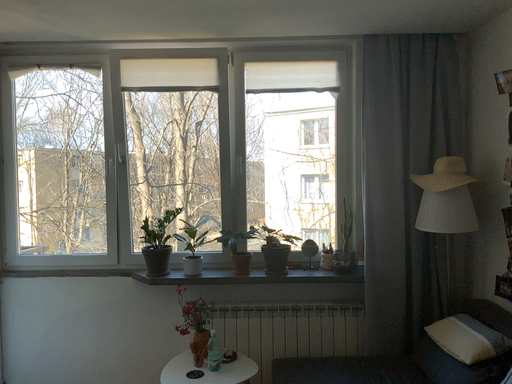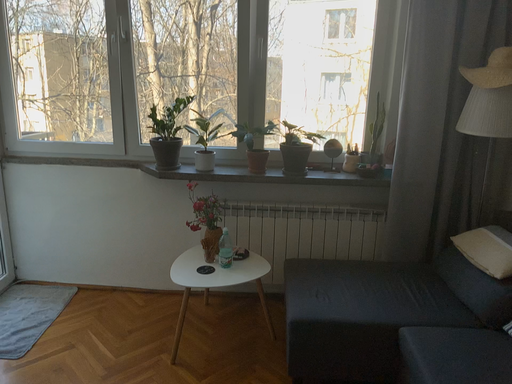
Question: How did the camera likely rotate when shooting the video?

Choices:
 (A) rotated upward
 (B) rotated downward

Answer: (B)